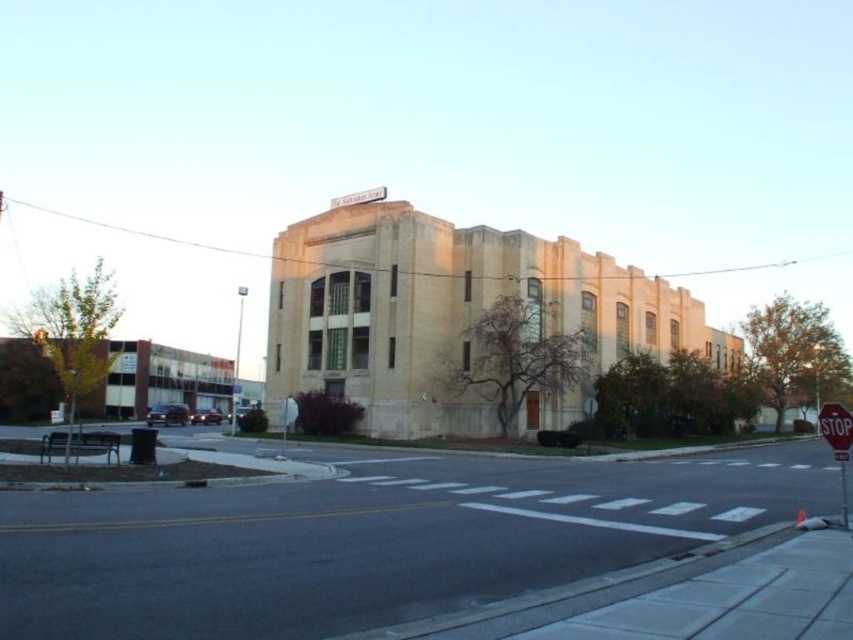
You are a pedestrian standing at the crosswalk. You see the red matte stop sign at lower right and the white plastic sign at upper center. Which sign is bigger?

The red matte stop sign at lower right is larger in size than the white plastic sign at upper center.

Based on the photo, you are a city planner assessing the visibility of signs in the area. You need to ensure that the red matte stop sign at lower right and the white plastic sign at upper center are both visible to drivers approaching the intersection. Based on their sizes, which sign is more likely to be seen from a greater distance?

The red matte stop sign at lower right is more likely to be seen from a greater distance because its width is larger than the white plastic sign at upper center.

You are a pedestrian approaching the crosswalk. You see the red matte stop sign at lower right and the white plastic sign at upper center. Which sign is nearer to you?

The red matte stop sign at lower right is closer to the viewer than the white plastic sign at upper center, so the red matte stop sign at lower right is nearer to you.